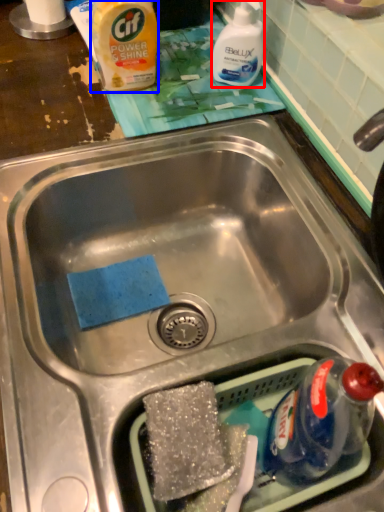
Question: Which object is further to the camera taking this photo, cleaning product (highlighted by a red box) or product (highlighted by a blue box)?

Choices:
 (A) cleaning product
 (B) product

Answer: (A)